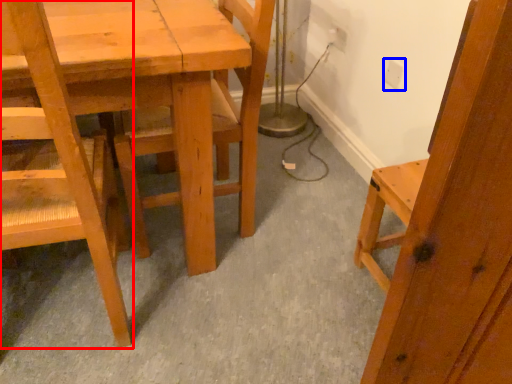
Question: Which of the following is the closest to the observer, chair (highlighted by a red box) or electric outlet (highlighted by a blue box)?

Choices:
 (A) chair
 (B) electric outlet

Answer: (A)